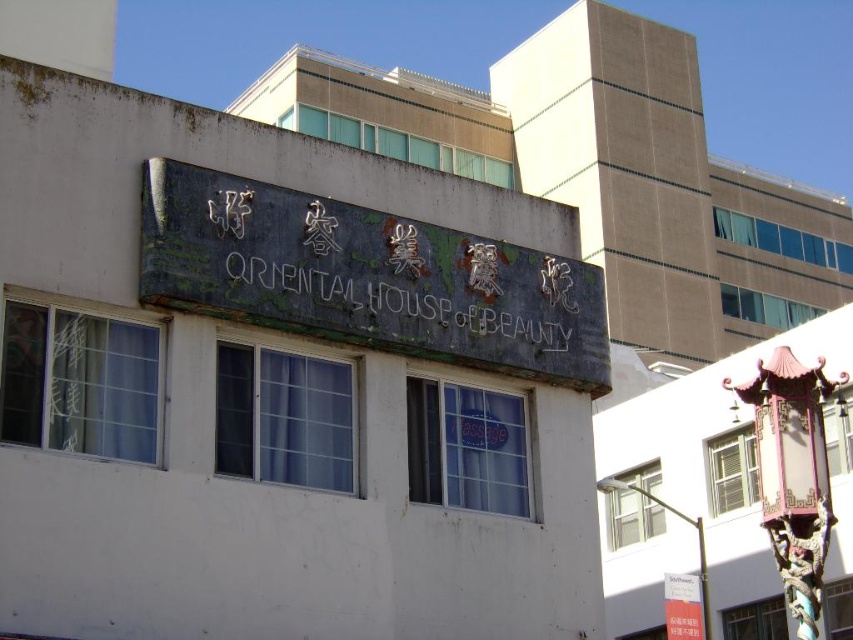
You are a delivery person approaching the Oriental House of Beauty. You need to attach a package to the closest metallic object. Which object should you choose between the metallic signboard at center and the metallic pole at lower right?

The metallic pole at lower right is closer to you than the metallic signboard at center, so you should attach the package to the metallic pole at lower right.

You are standing in front of a building and see the metallic signboard at center. If you want to take a photo of the entire signboard without any cropping, what should you do?

The metallic signboard at center is 145.75 feet away from the camera. To capture the entire signboard without cropping, you should move closer to the signboard until you are within 145.75 feet distance.

You are a delivery person trying to locate the entrance to the Oriental House of Beauty. You see the dark green stone sign at center and the metallic pole at lower right. Which object is taller?

The dark green stone sign at center has a lesser height compared to metallic pole at lower right, so the metallic pole at lower right is taller.